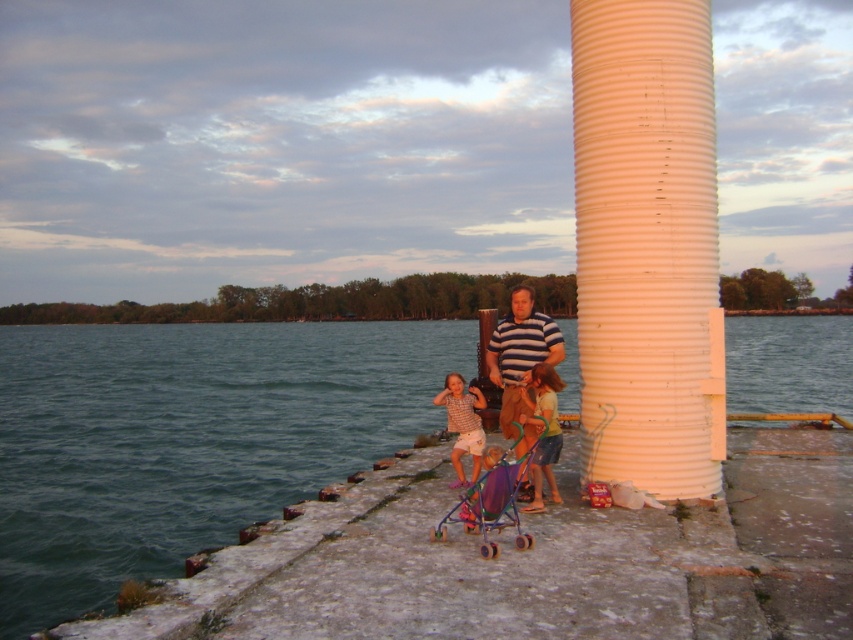
You are standing at the lakeside and want to take a photo of the white ribbed cylinder at right. If your camera can focus on objects up to 25 feet away, will you need to move closer or farther away to capture it clearly?

The white ribbed cylinder at right is 26.80 feet away, which is beyond the camera focus range of 25 feet. You need to move closer to ensure it is within the focus range.

You are standing on the lakeside pier and notice the white ribbed cylinder at right and the green fabric shirt at lower center. Which object is taller?

The white ribbed cylinder at right is taller than the green fabric shirt at lower center according to the description.